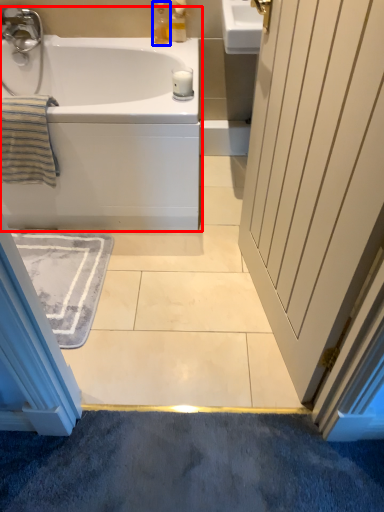
Question: Which point is closer to the camera, bathtub (highlighted by a red box) or soap dispenser (highlighted by a blue box)?

Choices:
 (A) bathtub
 (B) soap dispenser

Answer: (A)